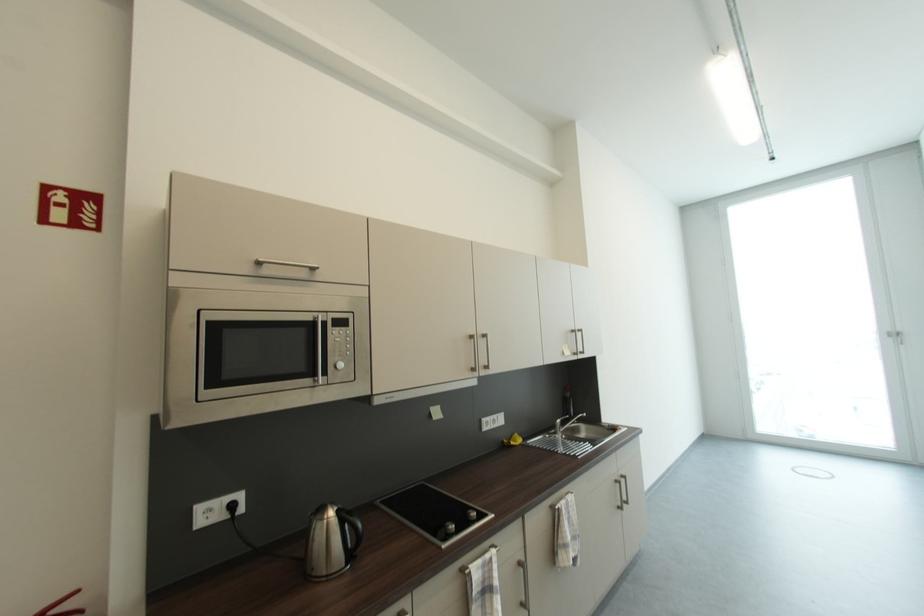
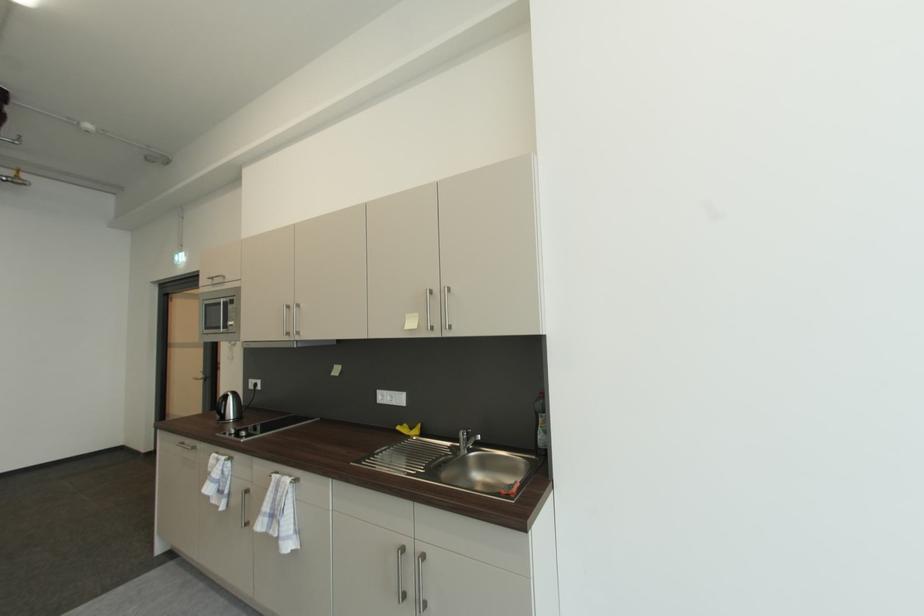
The point at (511, 444) is marked in the first image. Where is the corresponding point in the second image?

(408, 427)